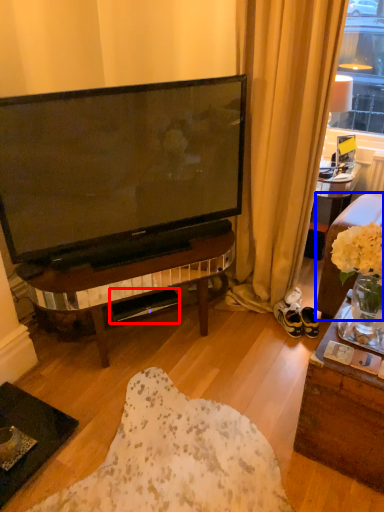
Question: Among these objects, which one is nearest to the camera, loudspeaker (highlighted by a red box) or studio couch (highlighted by a blue box)?

Choices:
 (A) loudspeaker
 (B) studio couch

Answer: (B)